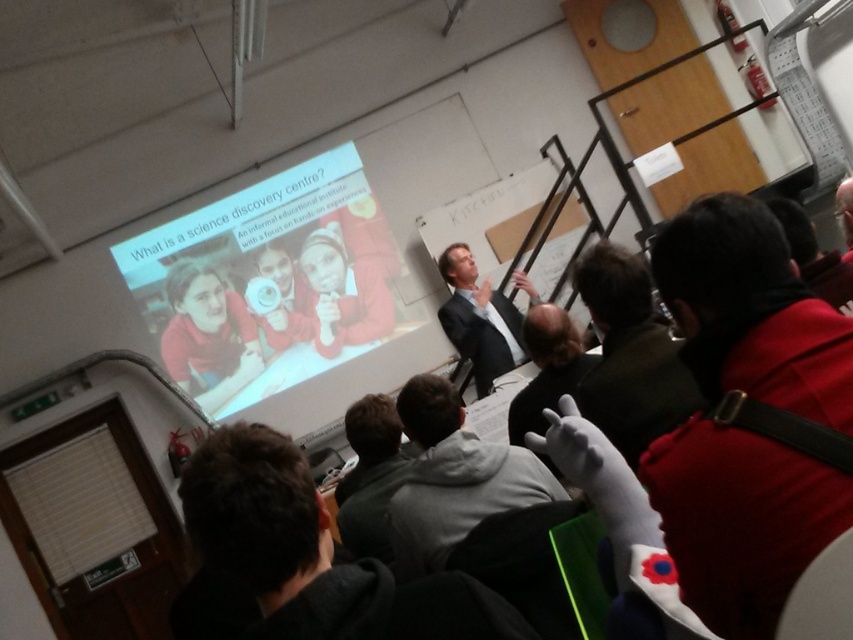
Question: Which of the following is the closest to the observer?

Choices:
 (A) dark gray hoodie at lower right
 (B) matte red sweater at center
 (C) red fleece jacket at upper right

Answer: (A)

Question: Is dark gray hoodie at center thinner than red fleece jacket at upper right?

Choices:
 (A) no
 (B) yes

Answer: (B)

Question: Which point is closer to the camera taking this photo?

Choices:
 (A) (509, 483)
 (B) (349, 307)
 (C) (563, 365)
 (D) (634, 426)

Answer: (D)

Question: Among these objects, which one is nearest to the camera?

Choices:
 (A) dark suit at center
 (B) matte red sweater at center
 (C) dark gray hoodie at lower right

Answer: (C)

Question: Is dark suit at center below red fleece jacket at upper right?

Choices:
 (A) no
 (B) yes

Answer: (B)

Question: Is the position of dark gray hoodie at center more distant than that of red fleece jacket at upper right?

Choices:
 (A) yes
 (B) no

Answer: (A)